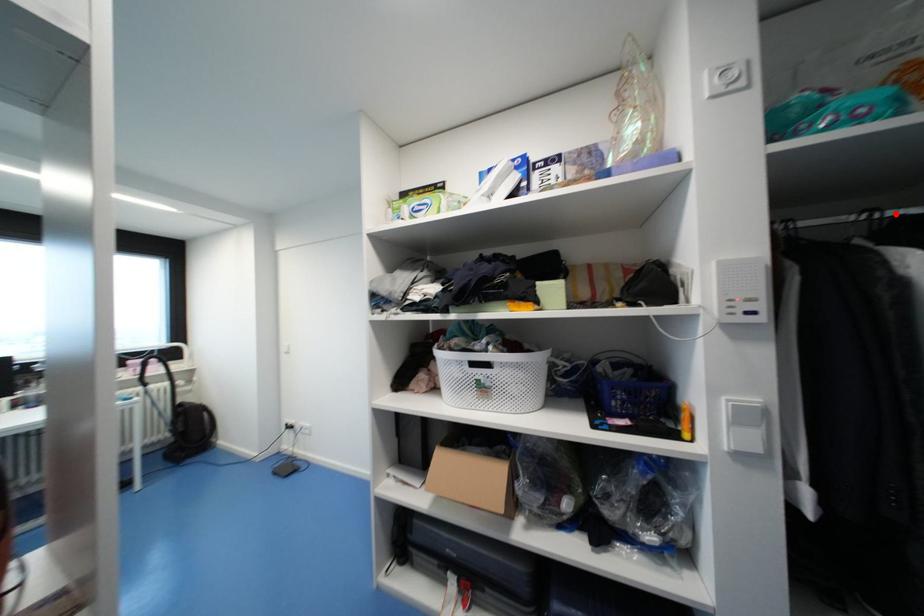
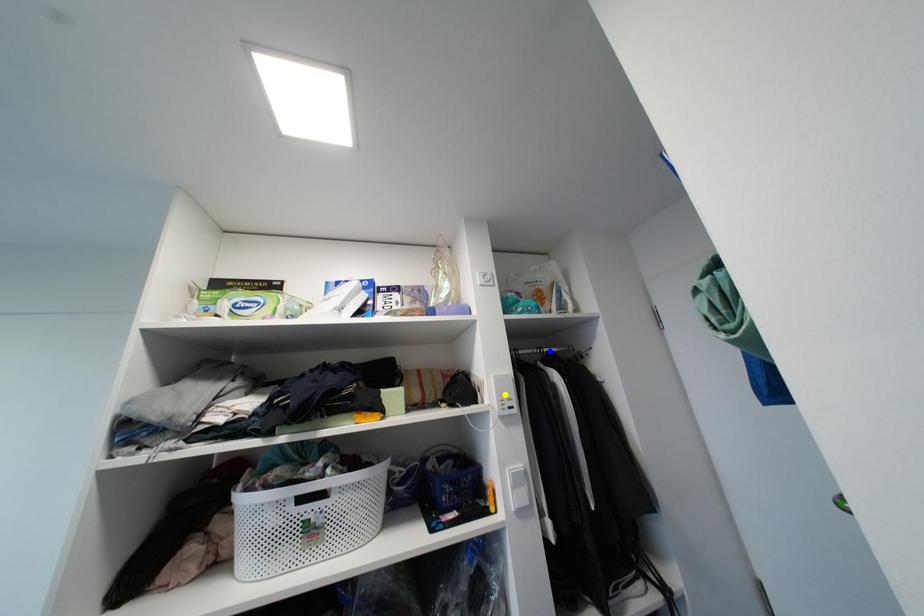
Question: I am providing you with two images of the same scene from different viewpoints. A red point is marked on the first image. You are given multiple points on the second image. Which mark in image 2 goes with the point in image 1?

Choices:
 (A) green point
 (B) blue point
 (C) yellow point

Answer: (B)